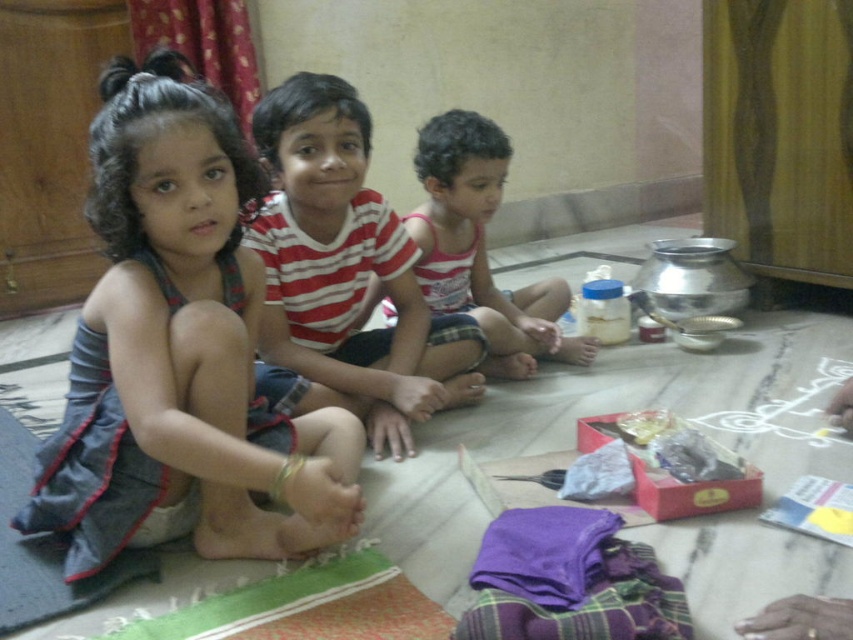
What do you see at coordinates (180, 356) in the screenshot?
I see `denim skirt at center` at bounding box center [180, 356].

Which is more to the left, denim skirt at center or matte pink tank top at center?

denim skirt at center is more to the left.

The height and width of the screenshot is (640, 853). What do you see at coordinates (180, 356) in the screenshot?
I see `denim skirt at center` at bounding box center [180, 356].

The height and width of the screenshot is (640, 853). In order to click on denim skirt at center in this screenshot , I will do `click(180, 356)`.

Who is lower down, denim skirt at center or dark grey fabric mat at lower left?

Positioned lower is dark grey fabric mat at lower left.

Consider the image. Who is more forward, (312, 456) or (77, 593)?

Point (77, 593) is more forward.

Which is behind, point (219, 147) or point (61, 557)?

Point (61, 557)

Locate an element on the screen. Image resolution: width=853 pixels, height=640 pixels. denim skirt at center is located at coordinates (180, 356).

Does striped cotton shirt at center appear on the left side of matte pink tank top at center?

Yes, striped cotton shirt at center is to the left of matte pink tank top at center.

The height and width of the screenshot is (640, 853). What do you see at coordinates (341, 273) in the screenshot?
I see `striped cotton shirt at center` at bounding box center [341, 273].

Identify the location of striped cotton shirt at center. (341, 273).

Where is `striped cotton shirt at center`? Image resolution: width=853 pixels, height=640 pixels. striped cotton shirt at center is located at coordinates (341, 273).